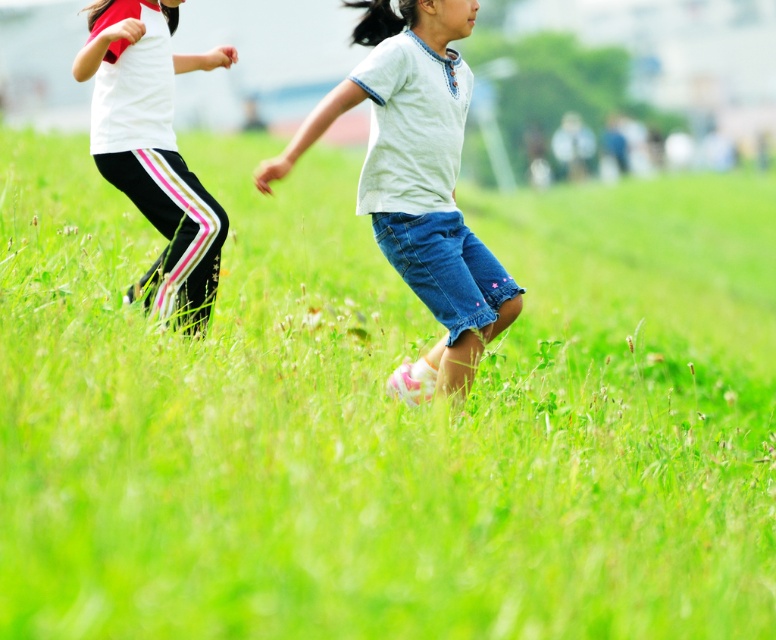
Question: Is white cotton shirt at center smaller than white matte pants at left?

Choices:
 (A) yes
 (B) no

Answer: (A)

Question: Which point is closer to the camera?

Choices:
 (A) (286, 156)
 (B) (101, 20)

Answer: (A)

Question: Can you confirm if white cotton shirt at center is positioned below white matte pants at left?

Choices:
 (A) no
 (B) yes

Answer: (B)

Question: Which point is closer to the camera taking this photo?

Choices:
 (A) (451, 284)
 (B) (215, 51)

Answer: (A)

Question: Among these objects, which one is farthest from the camera?

Choices:
 (A) white matte pants at left
 (B) white cotton shirt at center

Answer: (A)

Question: Can you confirm if white cotton shirt at center is positioned below white matte pants at left?

Choices:
 (A) yes
 (B) no

Answer: (A)